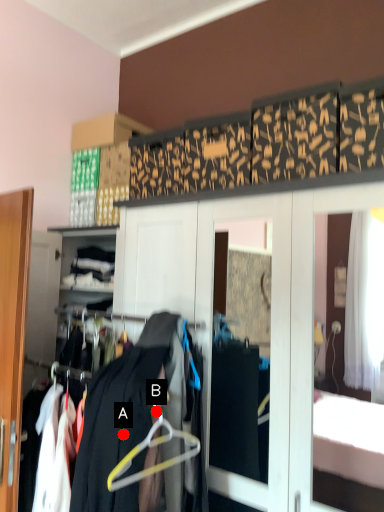
Question: Two points are circled on the image, labeled by A and B beside each circle. Which point is further to the camera?

Choices:
 (A) A is further
 (B) B is further

Answer: (B)